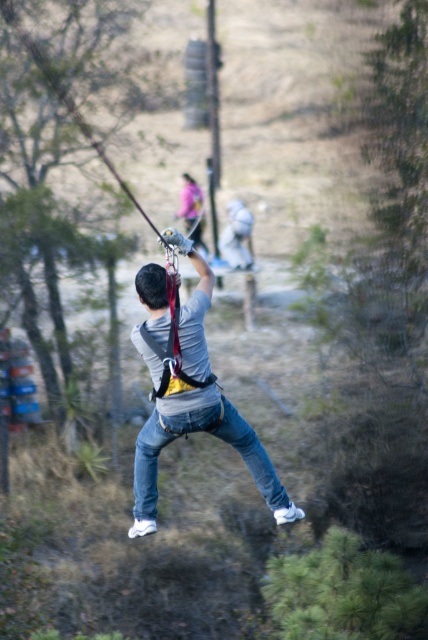
Looking at this image, you are a safety inspector checking the equipment of a zipliner. You notice the denim jeans at center and the matte gray helmet at upper center. Which piece of equipment is larger in size?

The denim jeans at center has a larger size compared to the matte gray helmet at upper center.

You are observing a person ziplining in a forest. You notice two points marked in the image. The first point is at coordinates point (148, 304) and the second is at point (109, 289). Which point is closer to your viewpoint?

Point (148, 304) is closer to the camera than point (109, 289).

You are a safety inspector evaluating the zipline setup. You notice the denim jeans at center and the matte gray helmet at upper center. According to safety protocols, which item should be checked first for proper attachment?

The matte gray helmet at upper center should be checked first because it is positioned above the denim jeans at center, indicating it is part of the upper body safety gear closer to the harness attachment point.